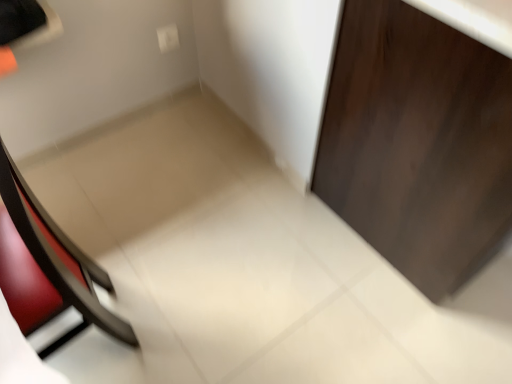
Question: Is matte black chair at left directly adjacent to white plastic electric outlet at upper center?

Choices:
 (A) yes
 (B) no

Answer: (B)

Question: Would you say white plastic electric outlet at upper center is part of matte black chair at left's contents?

Choices:
 (A) yes
 (B) no

Answer: (B)

Question: Are matte black chair at left and white plastic electric outlet at upper center located far from each other?

Choices:
 (A) no
 (B) yes

Answer: (A)

Question: Is matte black chair at left to the right of white plastic electric outlet at upper center from the viewer's perspective?

Choices:
 (A) yes
 (B) no

Answer: (B)

Question: From the image's perspective, is matte black chair at left beneath white plastic electric outlet at upper center?

Choices:
 (A) yes
 (B) no

Answer: (A)

Question: Choose the correct answer: Is matte black chair at left inside white plastic electric outlet at upper center or outside it?

Choices:
 (A) inside
 (B) outside

Answer: (B)

Question: Based on their positions, is matte black chair at left located to the left or right of white plastic electric outlet at upper center?

Choices:
 (A) left
 (B) right

Answer: (A)

Question: Is matte black chair at left wider or thinner than white plastic electric outlet at upper center?

Choices:
 (A) thin
 (B) wide

Answer: (B)

Question: From a real-world perspective, is matte black chair at left above or below white plastic electric outlet at upper center?

Choices:
 (A) below
 (B) above

Answer: (B)

Question: Would you say matte black chair at left is to the left or to the right of dark wood door at right in the picture?

Choices:
 (A) left
 (B) right

Answer: (A)

Question: Considering their positions, is matte black chair at left located in front of or behind dark wood door at right?

Choices:
 (A) front
 (B) behind

Answer: (A)

Question: From a real-world perspective, is matte black chair at left physically located above or below dark wood door at right?

Choices:
 (A) above
 (B) below

Answer: (A)

Question: Do you think matte black chair at left is within dark wood door at right, or outside of it?

Choices:
 (A) outside
 (B) inside

Answer: (A)

Question: In terms of size, does white plastic electric outlet at upper center appear bigger or smaller than dark wood door at right?

Choices:
 (A) big
 (B) small

Answer: (B)

Question: Is white plastic electric outlet at upper center in front of or behind dark wood door at right in the image?

Choices:
 (A) front
 (B) behind

Answer: (B)